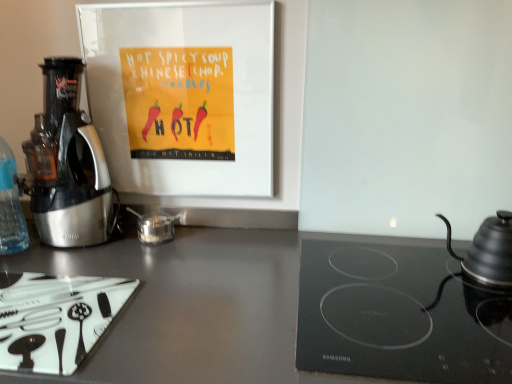
Locate an element on the screen. free space above matte gray countertop at center (from a real-world perspective) is located at coordinates (202, 290).